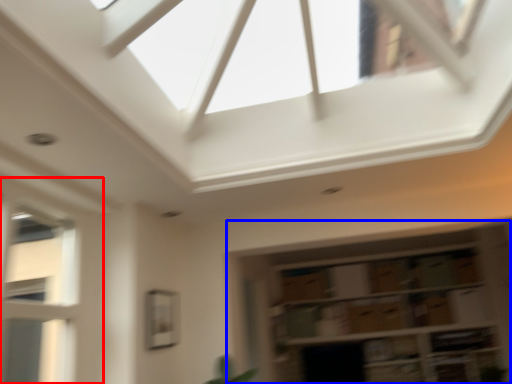
Question: Which of the following is the farthest to the observer, window (highlighted by a red box) or shelf (highlighted by a blue box)?

Choices:
 (A) window
 (B) shelf

Answer: (B)